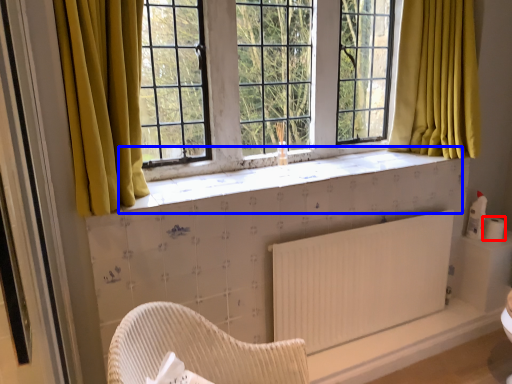
Question: Which object appears closest to the camera in this image, toilet paper (highlighted by a red box) or window sill (highlighted by a blue box)?

Choices:
 (A) toilet paper
 (B) window sill

Answer: (B)